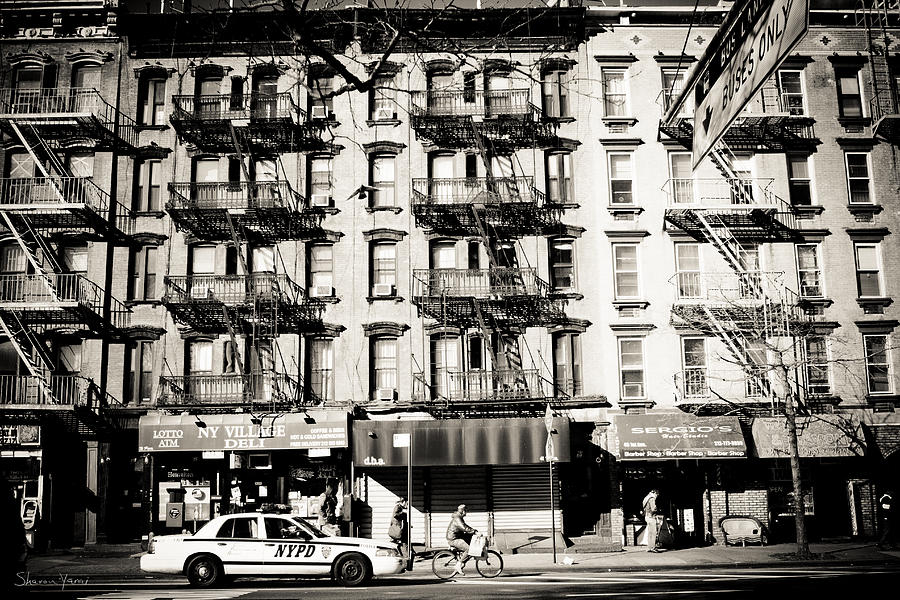
Identify the location of windows. This screenshot has width=900, height=600. (627, 282), (617, 179), (382, 273), (380, 99), (616, 93), (804, 168).